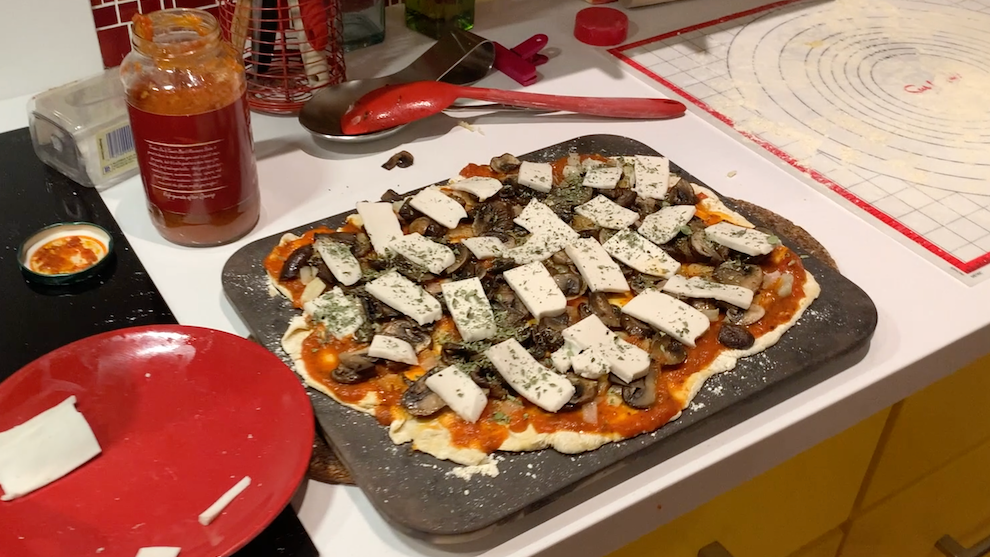
The width and height of the screenshot is (990, 557). I want to click on plastic jar lid, so click(603, 19).